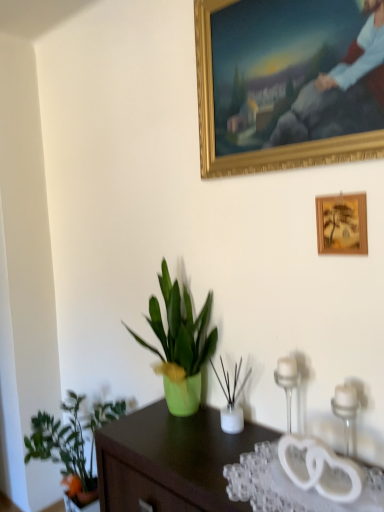
What are the coordinates of `vacant space situated above transparent plastic glass table at lower right (from a real-world perspective)` in the screenshot? It's located at (295, 481).